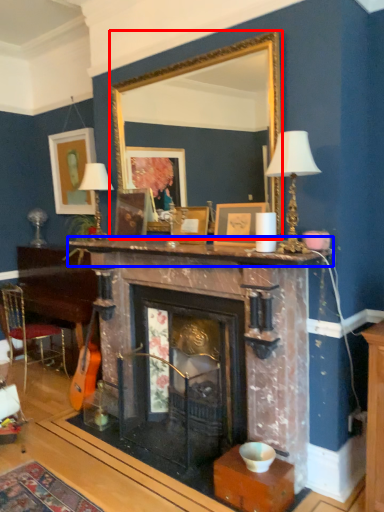
Question: Among these objects, which one is farthest to the camera, mirror (highlighted by a red box) or mantle (highlighted by a blue box)?

Choices:
 (A) mirror
 (B) mantle

Answer: (A)